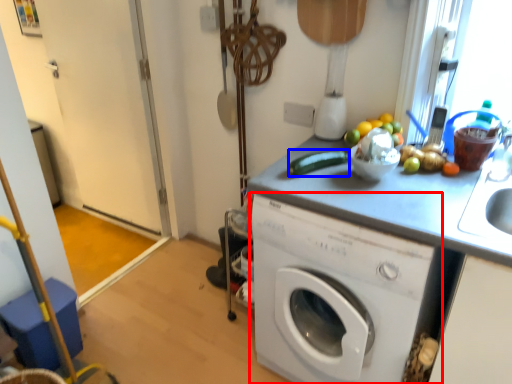
Question: Which object appears farthest to the camera in this image, washing machine (highlighted by a red box) or vegetable (highlighted by a blue box)?

Choices:
 (A) washing machine
 (B) vegetable

Answer: (B)